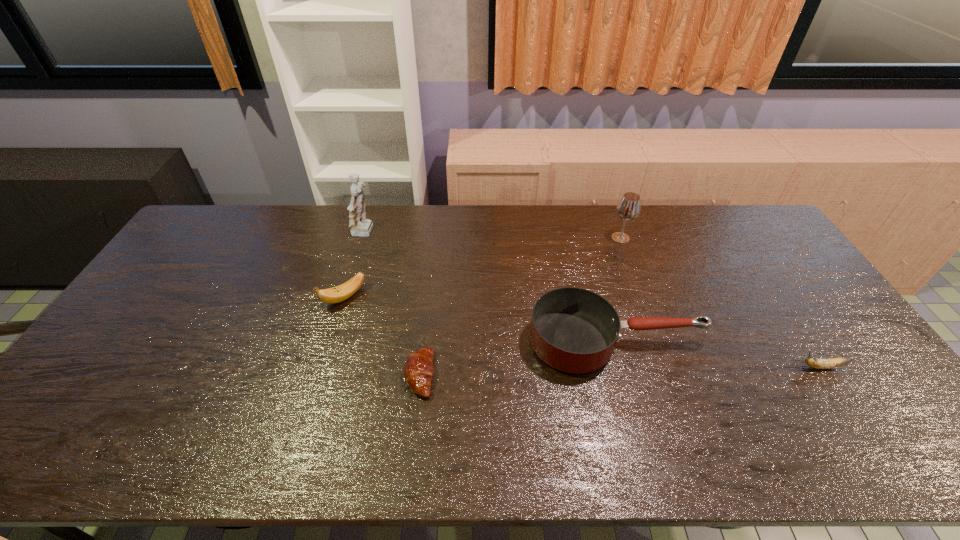
This screenshot has height=540, width=960. I want to click on vacant space positioned on the front of the wineglass, so click(638, 286).

Locate an element on the screen. The height and width of the screenshot is (540, 960). vacant space positioned on the handle side of the pan is located at coordinates (834, 341).

At what (x,y) coordinates should I click in order to perform the action: click on vacant area situated 0.100m on the front of the farther banana. Please return your answer as a coordinate pair (x, y). This screenshot has width=960, height=540. Looking at the image, I should click on (332, 339).

I want to click on free spot located on the peel of the rightmost object, so click(x=730, y=367).

I want to click on vacant space situated 0.390m on the peel of the rightmost object, so (650, 367).

Image resolution: width=960 pixels, height=540 pixels. I want to click on vacant space situated on the peel of the rightmost object, so click(x=714, y=367).

This screenshot has width=960, height=540. In order to click on blank area located 0.360m on the right of the crescent roll in this screenshot , I will do `click(572, 375)`.

Identify the location of figurine present at the far edge. (360, 226).

Locate an element on the screen. wineglass that is positioned at the far edge is located at coordinates (629, 207).

Identify the location of object at the right edge. (837, 362).